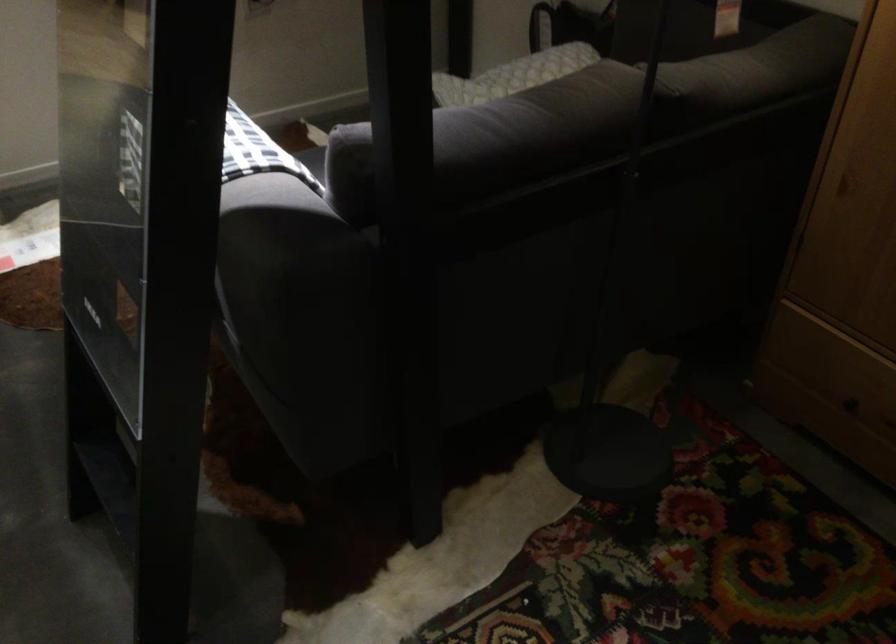
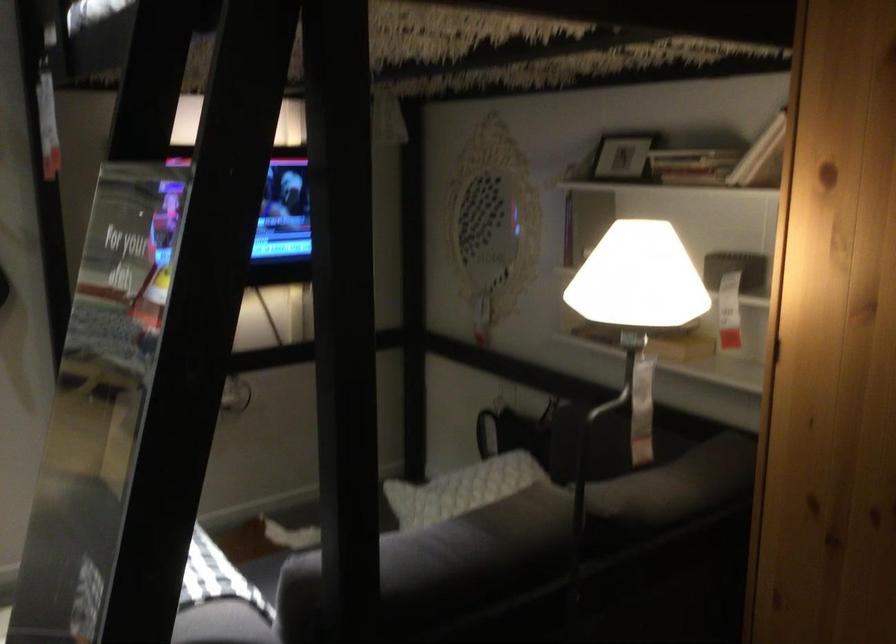
Question: How did the camera likely rotate?

Choices:
 (A) Left
 (B) Right
 (C) Up
 (D) Down

Answer: (C)